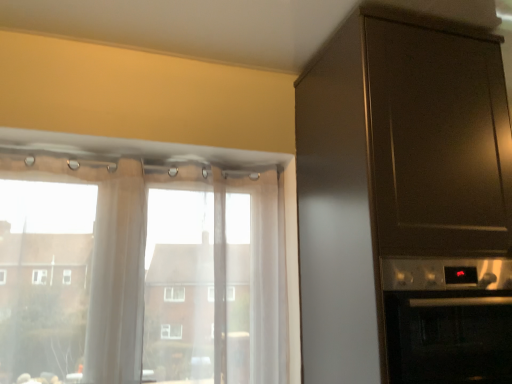
Question: Considering the relative positions of satin silver oven at right and translucent fabric at left in the image provided, is satin silver oven at right to the right of translucent fabric at left from the viewer's perspective?

Choices:
 (A) yes
 (B) no

Answer: (A)

Question: Is satin silver oven at right completely or partially outside of translucent fabric at left?

Choices:
 (A) no
 (B) yes

Answer: (B)

Question: From a real-world perspective, does satin silver oven at right stand above translucent fabric at left?

Choices:
 (A) yes
 (B) no

Answer: (B)

Question: Is satin silver oven at right positioned far away from translucent fabric at left?

Choices:
 (A) no
 (B) yes

Answer: (A)

Question: Considering the relative positions of satin silver oven at right and translucent fabric at left in the image provided, is satin silver oven at right behind translucent fabric at left?

Choices:
 (A) no
 (B) yes

Answer: (A)

Question: Can you confirm if satin silver oven at right is bigger than translucent fabric at left?

Choices:
 (A) yes
 (B) no

Answer: (A)

Question: Considering the relative sizes of translucent fabric at left and sheer white curtain at left in the image provided, is translucent fabric at left thinner than sheer white curtain at left?

Choices:
 (A) yes
 (B) no

Answer: (B)

Question: Is translucent fabric at left bigger than sheer white curtain at left?

Choices:
 (A) no
 (B) yes

Answer: (B)

Question: Considering the relative sizes of translucent fabric at left and sheer white curtain at left in the image provided, is translucent fabric at left shorter than sheer white curtain at left?

Choices:
 (A) no
 (B) yes

Answer: (A)

Question: Would you consider translucent fabric at left to be distant from sheer white curtain at left?

Choices:
 (A) yes
 (B) no

Answer: (B)

Question: Can you confirm if translucent fabric at left is smaller than sheer white curtain at left?

Choices:
 (A) no
 (B) yes

Answer: (A)

Question: Is sheer white curtain at left at the back of translucent fabric at left?

Choices:
 (A) no
 (B) yes

Answer: (B)

Question: Would you say sheer white curtain at left is a long distance from translucent fabric at left?

Choices:
 (A) yes
 (B) no

Answer: (B)